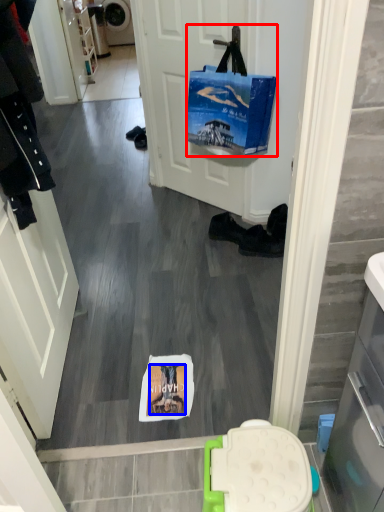
Question: Among these objects, which one is nearest to the camera, handbag (highlighted by a red box) or person (highlighted by a blue box)?

Choices:
 (A) handbag
 (B) person

Answer: (B)